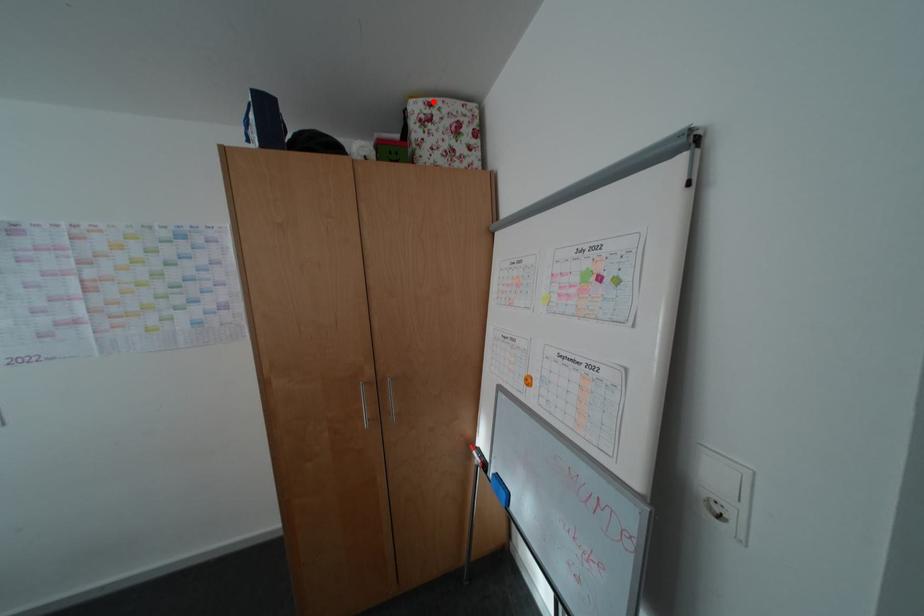
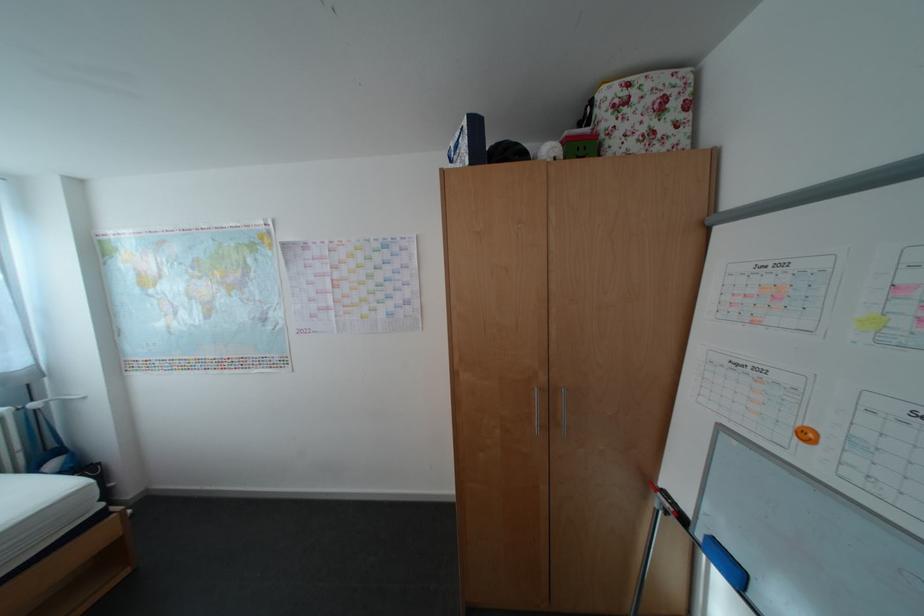
The point at the highlighted location is marked in the first image. Where is the corresponding point in the second image?

(628, 84)